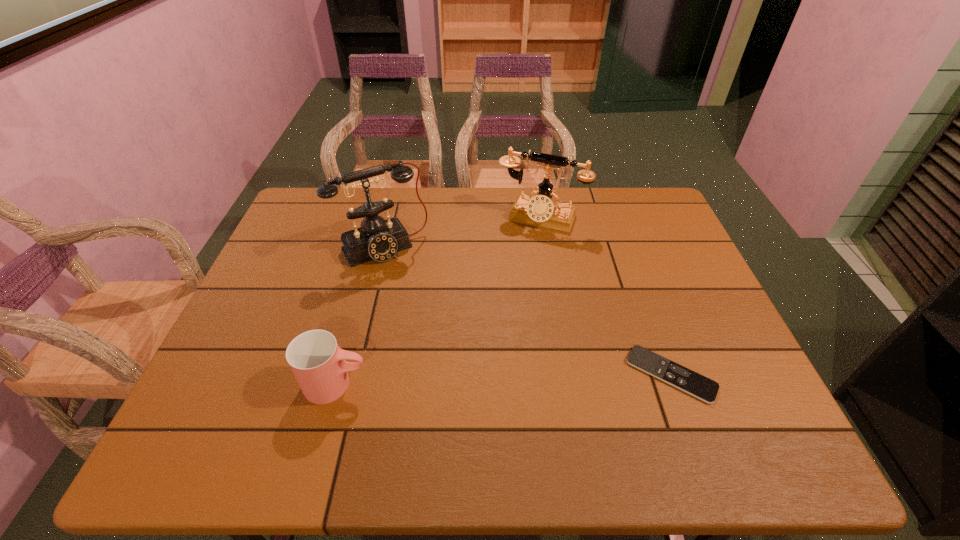
This screenshot has width=960, height=540. In order to click on free spot located 0.360m on the dial of the right telephone in this screenshot , I will do `click(489, 316)`.

The image size is (960, 540). Find the location of `vacant area situated on the dial of the left telephone`. vacant area situated on the dial of the left telephone is located at coordinates (462, 363).

At what (x,y) coordinates should I click in order to perform the action: click on free spot located 0.210m on the dial of the left telephone. Please return your answer as a coordinate pair (x, y). The width and height of the screenshot is (960, 540). Looking at the image, I should click on (432, 314).

Image resolution: width=960 pixels, height=540 pixels. I want to click on vacant region located on the dial of the left telephone, so point(445,336).

Where is `cup positioned at the near edge`? cup positioned at the near edge is located at coordinates (318, 363).

Where is `remote control at the near edge`? Image resolution: width=960 pixels, height=540 pixels. remote control at the near edge is located at coordinates (693, 383).

Locate an element on the screen. This screenshot has width=960, height=540. object positioned at the right edge is located at coordinates (693, 383).

Locate an element on the screen. The width and height of the screenshot is (960, 540). object that is at the near right corner is located at coordinates (693, 383).

Locate an element on the screen. Image resolution: width=960 pixels, height=540 pixels. vacant space at the far edge is located at coordinates coord(463,225).

This screenshot has width=960, height=540. What are the coordinates of `free space at the near edge of the desktop` in the screenshot? It's located at (433, 387).